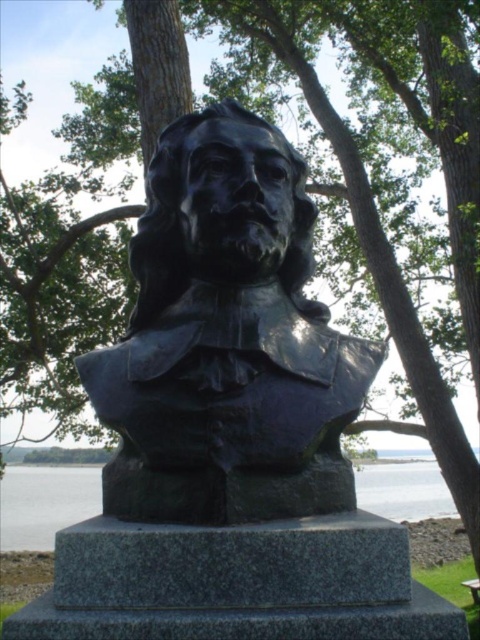
Is black polished bust at center taller than transparent water at base center?

Yes, black polished bust at center is taller than transparent water at base center.

Image resolution: width=480 pixels, height=640 pixels. What do you see at coordinates (227, 340) in the screenshot?
I see `black polished bust at center` at bounding box center [227, 340].

At what (x,y) coordinates should I click in order to perform the action: click on black polished bust at center. Please return your answer as a coordinate pair (x, y). Looking at the image, I should click on (227, 340).